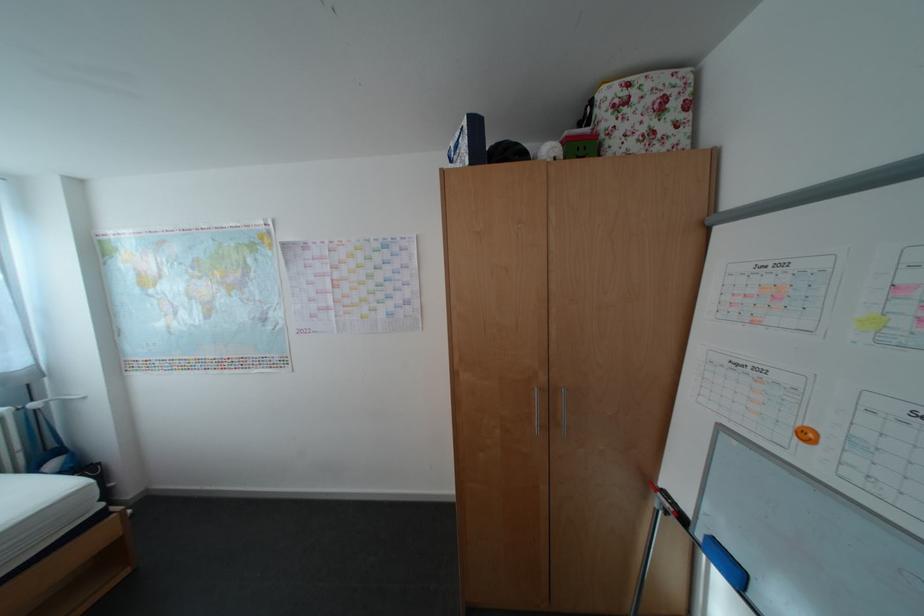
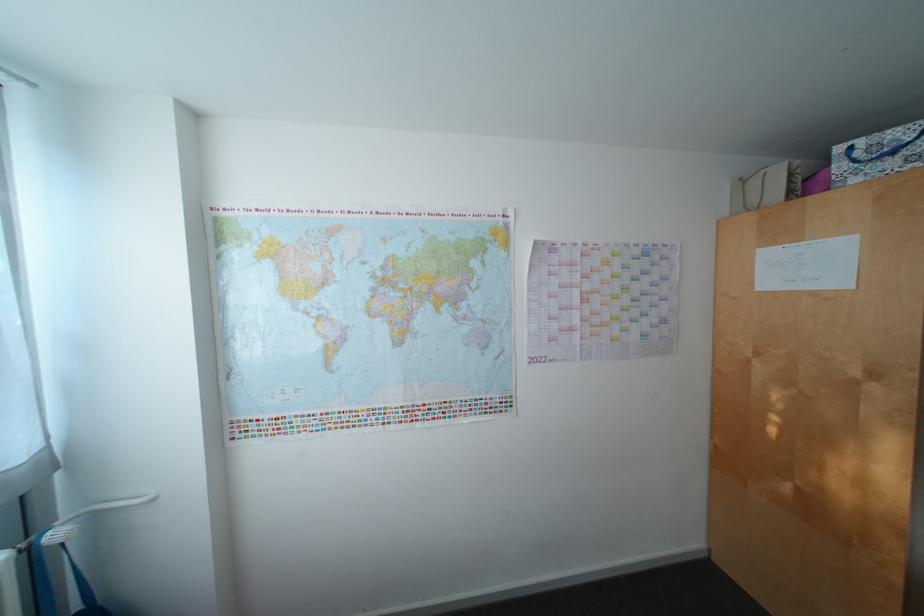
Question: What movement of the cameraman would produce the second image?

Choices:
 (A) Left
 (B) Right
 (C) Forward
 (D) Backward

Answer: (A)